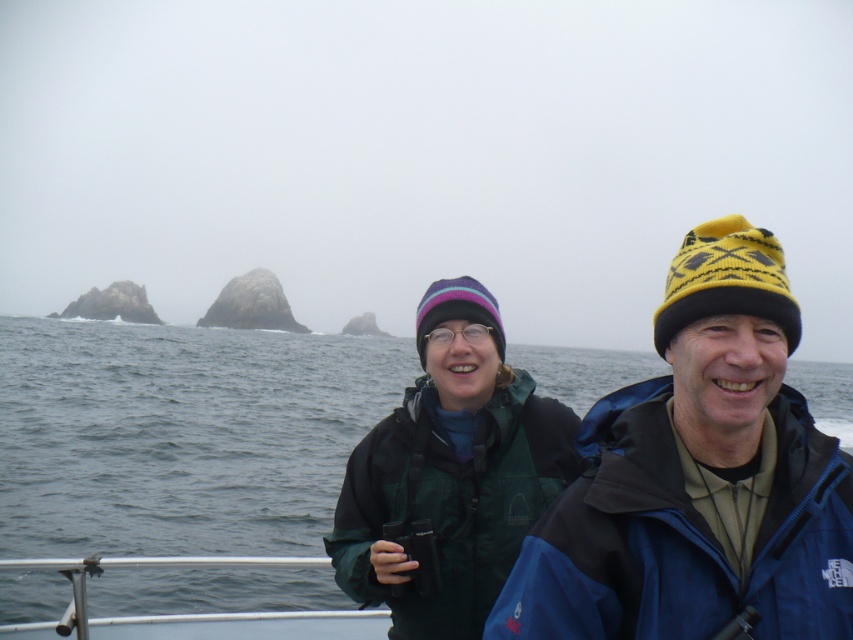
Between point (511, 541) and point (178, 634), which one is positioned in front?

Point (511, 541)

Which is behind, point (421, 422) or point (341, 627)?

Positioned behind is point (341, 627).

Does point (462, 340) come farther from viewer compared to point (102, 561)?

No, it is in front of (102, 561).

You are a GUI agent. You are given a task and a screenshot of the screen. Output one action in this format:
    pyautogui.click(x=<x>, y=<y>)
    Task: Click on the green matte jacket at center
    This screenshot has height=640, width=853.
    Given the screenshot: What is the action you would take?
    pyautogui.click(x=450, y=474)

Does blue fleece jacket at right have a lesser width compared to polished metal railing at lower left?

Correct, blue fleece jacket at right's width is less than polished metal railing at lower left's.

Does point (786, 541) lie in front of point (164, 616)?

Yes.

The height and width of the screenshot is (640, 853). I want to click on blue fleece jacket at right, so pyautogui.click(x=698, y=477).

Is gray water at center to the left of polished metal railing at lower left from the viewer's perspective?

Incorrect, gray water at center is not on the left side of polished metal railing at lower left.

Who is lower down, gray water at center or polished metal railing at lower left?

gray water at center is below.

Between point (148, 596) and point (178, 614), which one is positioned behind?

Point (148, 596)

Where is `gray water at center`? gray water at center is located at coordinates (181, 435).